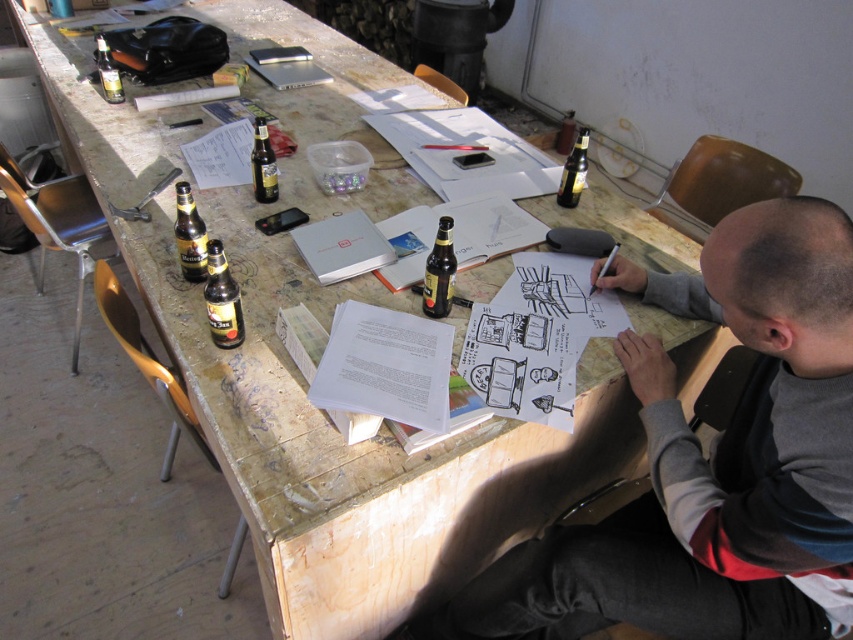
Question: Can you confirm if matte glass bottle at upper right is positioned above matte glass bottle at upper left?

Choices:
 (A) no
 (B) yes

Answer: (A)

Question: Does brown glass bottle at center appear on the right side of matte glass bottle at upper right?

Choices:
 (A) no
 (B) yes

Answer: (A)

Question: From the image, what is the correct spatial relationship of matte glass bottle at left in relation to matte glass bottle at upper right?

Choices:
 (A) above
 (B) below

Answer: (B)

Question: Which of the following is the farthest from the observer?

Choices:
 (A) matte glass bottle at upper left
 (B) matte glass bottle at left

Answer: (A)

Question: Which point appears closest to the camera in this image?

Choices:
 (A) (209, 301)
 (B) (109, 99)
 (C) (819, 365)
 (D) (444, 307)

Answer: (C)

Question: Which point is farther from the camera taking this photo?

Choices:
 (A) (200, 236)
 (B) (225, 326)

Answer: (A)